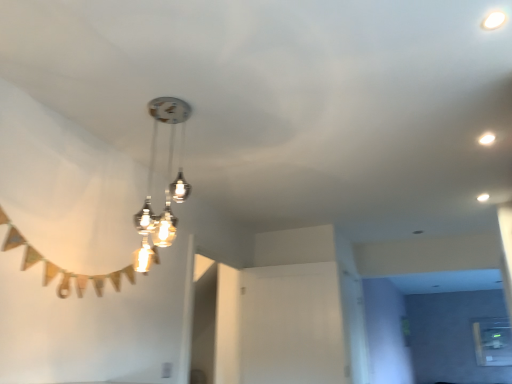
Question: Is metallic glass chandelier at center spatially inside transparent glass window at lower right, or outside of it?

Choices:
 (A) inside
 (B) outside

Answer: (B)

Question: From a real-world perspective, is metallic glass chandelier at center above or below transparent glass window at lower right?

Choices:
 (A) above
 (B) below

Answer: (A)

Question: Which object is the farthest from the metallic glass chandelier at center?

Choices:
 (A) transparent glass window at lower right
 (B) white glossy droplight at upper right

Answer: (A)

Question: Which object is the closest to the white glossy droplight at upper right?

Choices:
 (A) transparent glass window at lower right
 (B) metallic glass chandelier at center

Answer: (B)